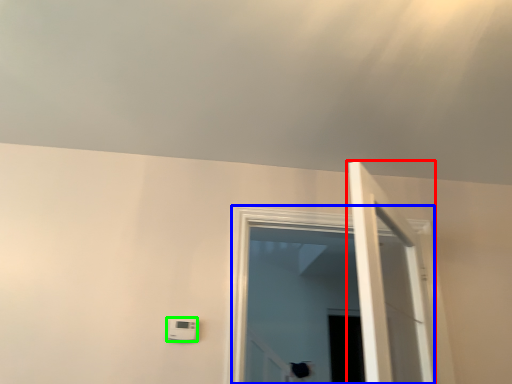
Question: Which object is the closest to the door (highlighted by a red box)? Choose among these: window (highlighted by a blue box) or light switch (highlighted by a green box).

Choices:
 (A) window
 (B) light switch

Answer: (A)